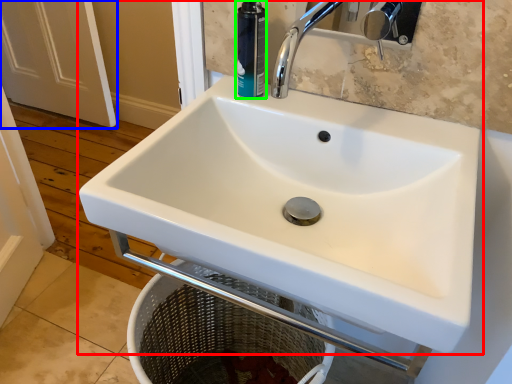
Question: Which is farther away from sink (highlighted by a red box)? screen door (highlighted by a blue box) or toiletry (highlighted by a green box)?

Choices:
 (A) screen door
 (B) toiletry

Answer: (A)